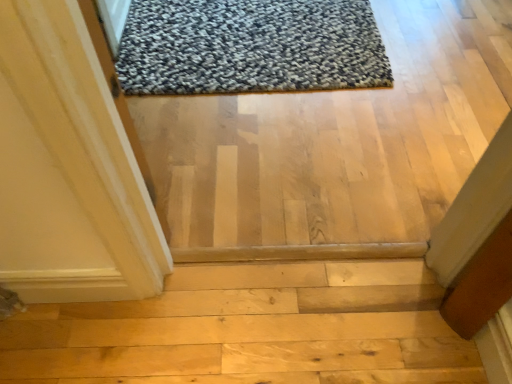
The height and width of the screenshot is (384, 512). What are the coordinates of `free space in front of textured gray rug at upper center` in the screenshot? It's located at (283, 155).